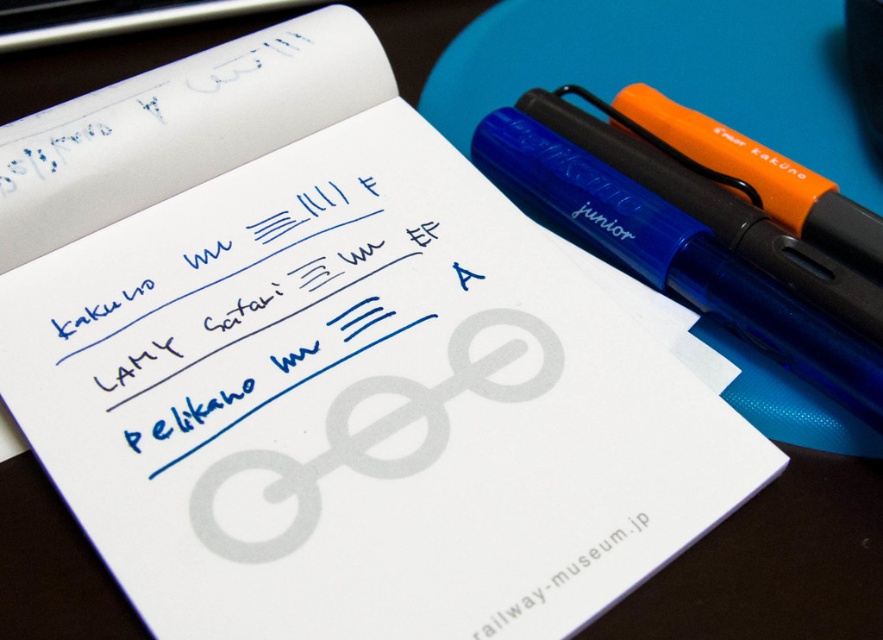
Is orange matte pen at upper right above white paper at lower center?

Yes, orange matte pen at upper right is above white paper at lower center.

Is orange matte pen at upper right bigger than white paper at lower center?

Yes.

I want to click on orange matte pen at upper right, so click(x=680, y=244).

What do you see at coordinates (243, 316) in the screenshot? I see `blue ink writing at center` at bounding box center [243, 316].

At what (x,y) coordinates should I click in order to perform the action: click on blue ink writing at center. Please return your answer as a coordinate pair (x, y). Looking at the image, I should click on (243, 316).

Is point (126, 284) more distant than point (572, 582)?

Yes, it is behind point (572, 582).

Is blue ink writing at center above white paper at lower center?

Correct, blue ink writing at center is located above white paper at lower center.

Where is `blue ink writing at center`? blue ink writing at center is located at coordinates (243, 316).